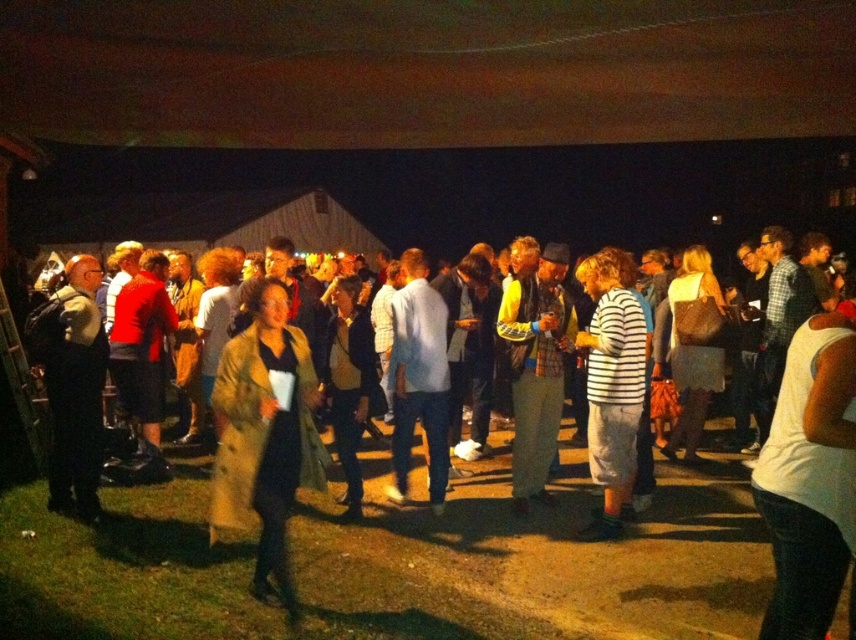
Question: Can you confirm if dark gray jacket at left is positioned below white striped shirt at center?

Choices:
 (A) yes
 (B) no

Answer: (B)

Question: Which point is closer to the camera?

Choices:
 (A) coord(403,292)
 (B) coord(220,368)

Answer: (B)

Question: Does tan textured coat at center appear under dark gray jacket at left?

Choices:
 (A) yes
 (B) no

Answer: (A)

Question: Does dark gray jacket at left appear over yellow-green fabric jacket at center?

Choices:
 (A) no
 (B) yes

Answer: (A)

Question: Which object is the closest to the tan textured coat at center?

Choices:
 (A) dark gray jacket at left
 (B) white striped shirt at center
 (C) light blue shirt at center
 (D) yellow-green fabric jacket at center

Answer: (C)

Question: Which of these objects is positioned closest to the tan textured coat at center?

Choices:
 (A) dark gray jacket at left
 (B) light blue shirt at center
 (C) yellow-green fabric jacket at center
 (D) white striped shirt at center

Answer: (B)